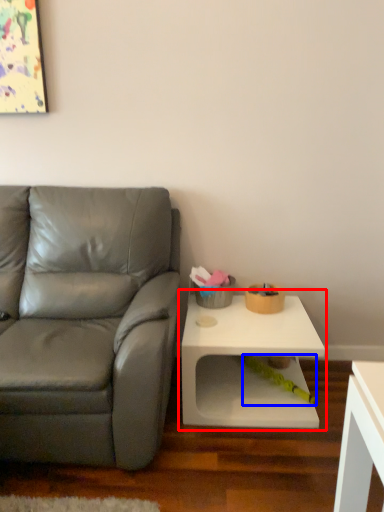
Question: Which object appears farthest to the camera in this image, table (highlighted by a red box) or toy (highlighted by a blue box)?

Choices:
 (A) table
 (B) toy

Answer: (B)